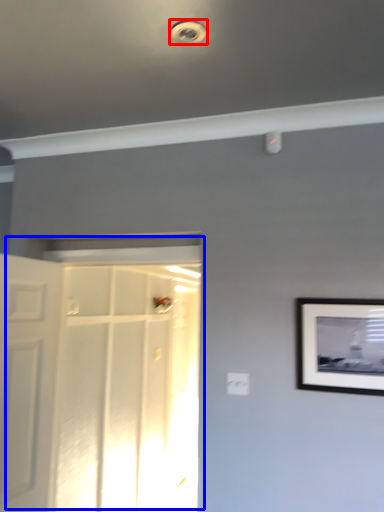
Question: Which object is closer to the camera taking this photo, droplight (highlighted by a red box) or door (highlighted by a blue box)?

Choices:
 (A) droplight
 (B) door

Answer: (A)